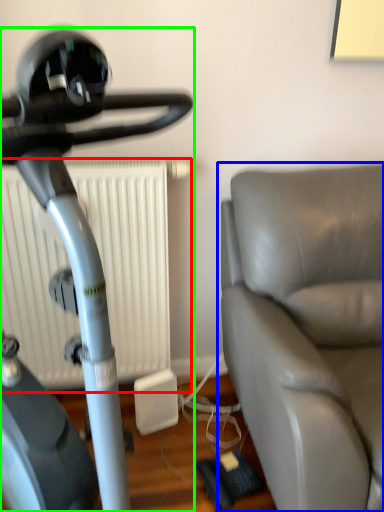
Question: Which is farther away from radiator (highlighted by a red box)? studio couch (highlighted by a blue box) or stationary bicycle (highlighted by a green box)?

Choices:
 (A) studio couch
 (B) stationary bicycle

Answer: (B)